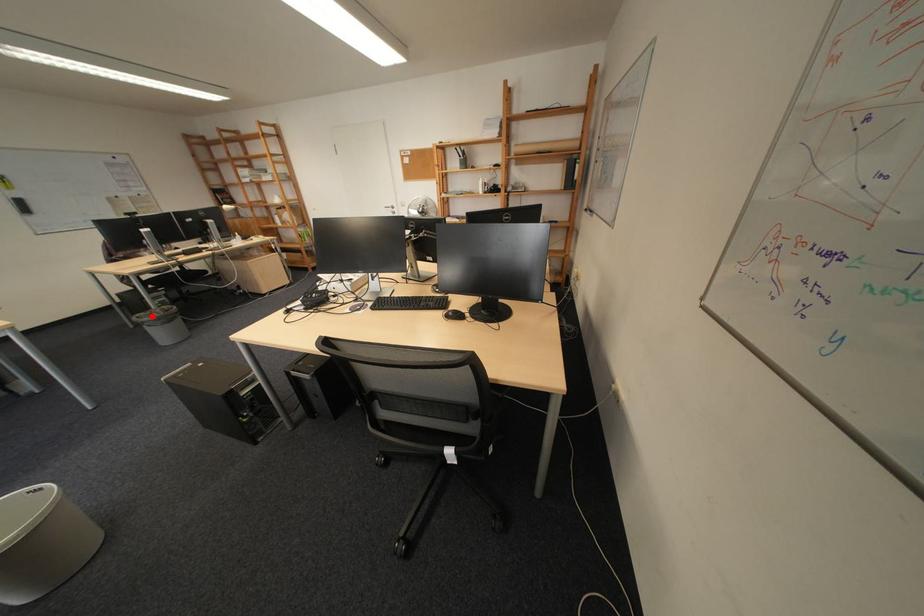
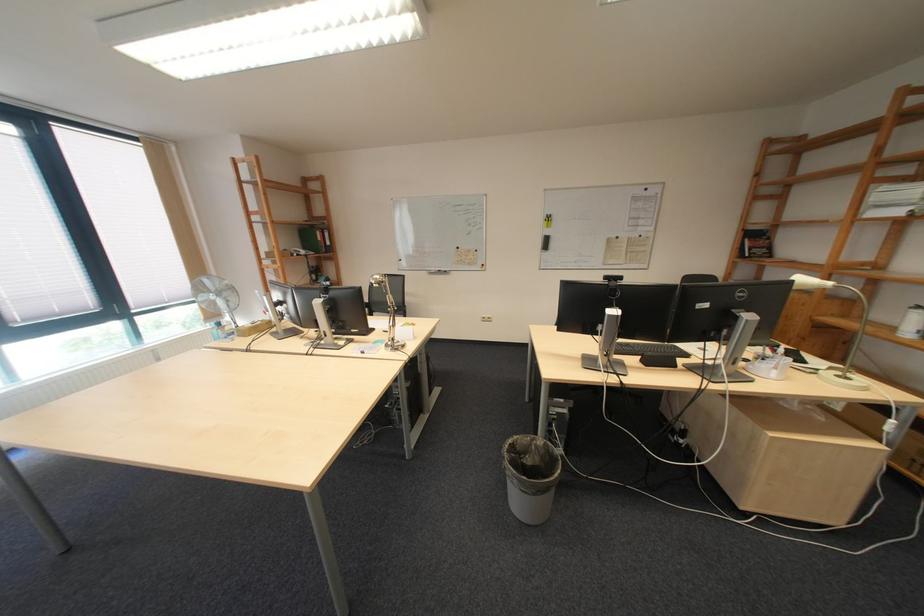
Question: I am providing you with two images of the same scene from different viewpoints. Image1 has a red point marked. In image2, the corresponding 3D location appears at what relative position? Reply with the corresponding letter.

Choices:
 (A) Closer
 (B) Farther

Answer: (A)